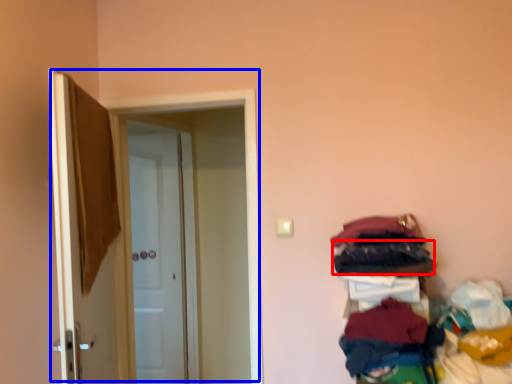
Question: Which of the following is the closest to the observer, clothing (highlighted by a red box) or door (highlighted by a blue box)?

Choices:
 (A) clothing
 (B) door

Answer: (A)